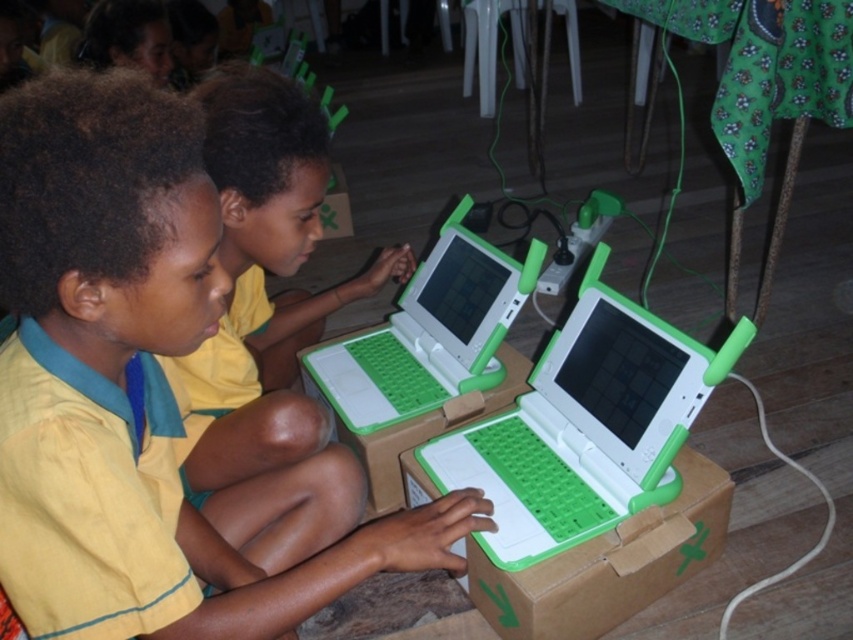
Question: Does yellow fabric shirt at center appear under green plastic laptop at center?

Choices:
 (A) yes
 (B) no

Answer: (A)

Question: Which point is farther to the camera?

Choices:
 (A) white plastic laptop at center
 (B) green cardboard box at center

Answer: (B)

Question: Which of the following is the farthest from the observer?

Choices:
 (A) (421, 404)
 (B) (740, 323)

Answer: (A)

Question: Among these points, which one is nearest to the camera?

Choices:
 (A) (44, 148)
 (B) (440, 232)
 (C) (265, 333)

Answer: (A)

Question: Does yellow fabric shirt at center appear over yellow shirt at center?

Choices:
 (A) yes
 (B) no

Answer: (B)

Question: Does white plastic laptop at center have a larger size compared to green cardboard box at center?

Choices:
 (A) no
 (B) yes

Answer: (B)